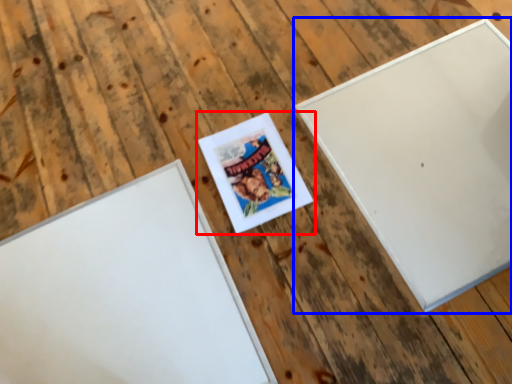
Question: Which object is closer to the camera taking this photo, picture frame (highlighted by a red box) or picture frame (highlighted by a blue box)?

Choices:
 (A) picture frame
 (B) picture frame

Answer: (B)